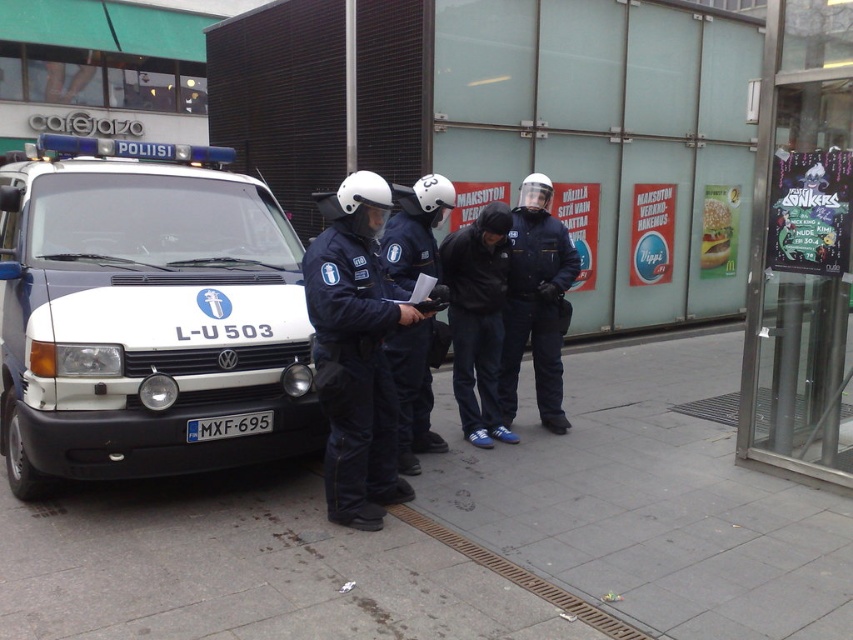
Looking at this image, you are a police officer standing at the van and need to locate your colleague in the scene. Where is the navy blue uniform at center located in relation to the van?

The navy blue uniform at center is located at point (357, 349) relative to the van.

You are a pedestrian standing on the sidewalk and see the black matte jacket at center and the blue metallic license plate at front in the image. Which object is higher from the ground?

The black matte jacket at center is much taller than the blue metallic license plate at front, so the black matte jacket at center is higher from the ground.